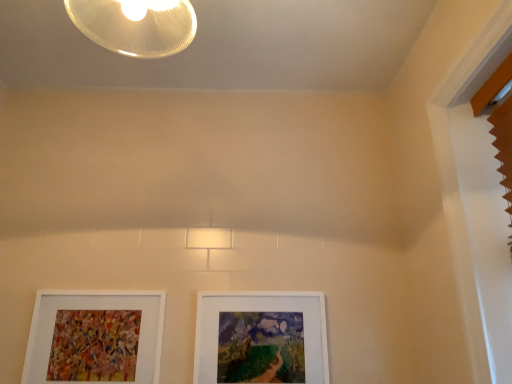
Question: From a real-world perspective, is white matte picture frame at center, marked as the 1th picture frame in a right-to-left arrangement, positioned over white matte picture frame at lower left, the second picture frame from the right, based on gravity?

Choices:
 (A) no
 (B) yes

Answer: (B)

Question: Considering the relative sizes of white matte picture frame at center, marked as the 2th picture frame in a left-to-right arrangement, and white matte picture frame at lower left, which is counted as the 1th picture frame, starting from the left, in the image provided, is white matte picture frame at center, marked as the 2th picture frame in a left-to-right arrangement, smaller than white matte picture frame at lower left, which is counted as the 1th picture frame, starting from the left,?

Choices:
 (A) no
 (B) yes

Answer: (A)

Question: Is white matte picture frame at lower left, the second picture frame from the right, inside white matte picture frame at center, marked as the 1th picture frame in a right-to-left arrangement?

Choices:
 (A) no
 (B) yes

Answer: (A)

Question: Is white matte picture frame at center, marked as the 2th picture frame in a left-to-right arrangement, facing away from white matte picture frame at lower left, which is counted as the 1th picture frame, starting from the left?

Choices:
 (A) yes
 (B) no

Answer: (B)

Question: Does white matte picture frame at center, marked as the 2th picture frame in a left-to-right arrangement, have a greater width compared to white matte picture frame at lower left, the second picture frame from the right?

Choices:
 (A) no
 (B) yes

Answer: (B)

Question: Considering the relative positions of white matte picture frame at center, marked as the 2th picture frame in a left-to-right arrangement, and white matte picture frame at lower left, the second picture frame from the right, in the image provided, is white matte picture frame at center, marked as the 2th picture frame in a left-to-right arrangement, behind white matte picture frame at lower left, the second picture frame from the right,?

Choices:
 (A) no
 (B) yes

Answer: (B)

Question: Is white matte picture frame at lower left, the second picture frame from the right, looking in the opposite direction of white matte picture frame at center, marked as the 2th picture frame in a left-to-right arrangement?

Choices:
 (A) yes
 (B) no

Answer: (B)

Question: Does white matte picture frame at lower left, which is counted as the 1th picture frame, starting from the left, have a greater height compared to white matte picture frame at center, marked as the 1th picture frame in a right-to-left arrangement?

Choices:
 (A) no
 (B) yes

Answer: (B)

Question: Does white matte picture frame at lower left, which is counted as the 1th picture frame, starting from the left, appear on the right side of white matte picture frame at center, marked as the 1th picture frame in a right-to-left arrangement?

Choices:
 (A) yes
 (B) no

Answer: (B)

Question: Is white matte picture frame at lower left, which is counted as the 1th picture frame, starting from the left, positioned beyond the bounds of white matte picture frame at center, marked as the 1th picture frame in a right-to-left arrangement?

Choices:
 (A) yes
 (B) no

Answer: (A)

Question: From the image's perspective, is white matte picture frame at lower left, which is counted as the 1th picture frame, starting from the left, on white matte picture frame at center, marked as the 1th picture frame in a right-to-left arrangement?

Choices:
 (A) no
 (B) yes

Answer: (B)

Question: Is white matte picture frame at lower left, which is counted as the 1th picture frame, starting from the left, thinner than white matte picture frame at center, marked as the 2th picture frame in a left-to-right arrangement?

Choices:
 (A) yes
 (B) no

Answer: (A)

Question: Considering the relative positions of white matte picture frame at lower left, which is counted as the 1th picture frame, starting from the left, and white matte picture frame at center, marked as the 2th picture frame in a left-to-right arrangement, in the image provided, is white matte picture frame at lower left, which is counted as the 1th picture frame, starting from the left, to the left or to the right of white matte picture frame at center, marked as the 2th picture frame in a left-to-right arrangement,?

Choices:
 (A) right
 (B) left

Answer: (B)